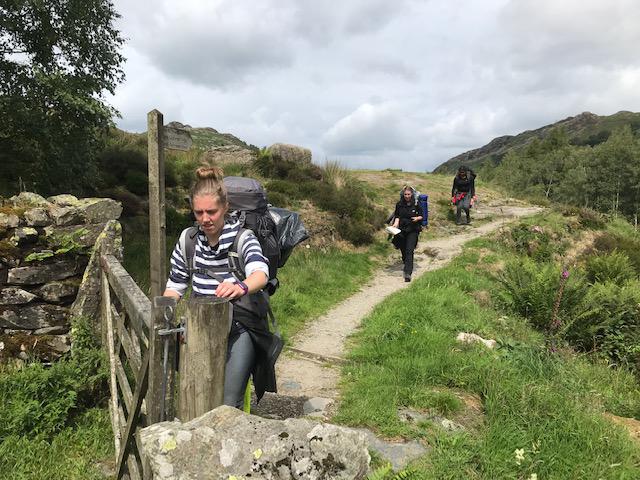
In order to click on flowering plant in this screenshot , I will do `click(555, 316)`.